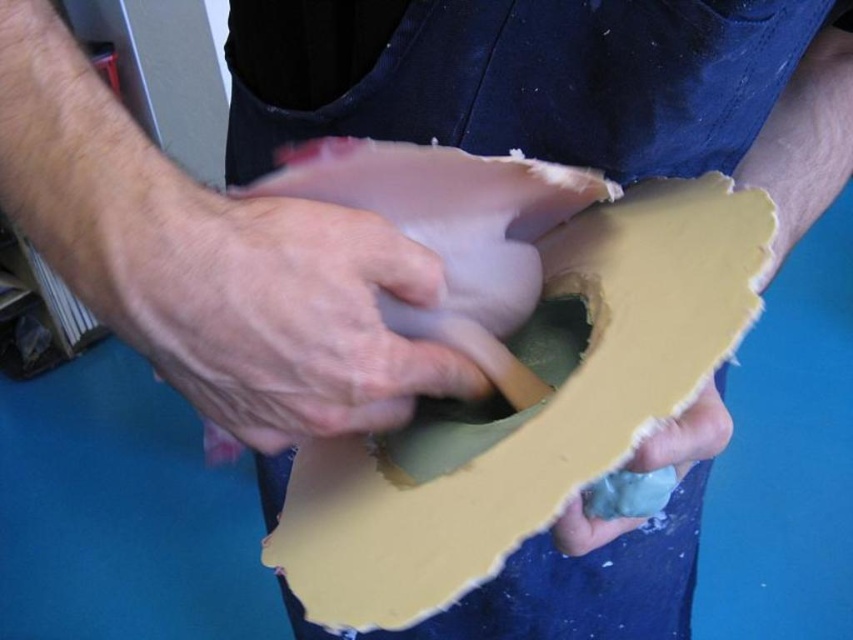
You are a craft instructor observing a student working on a project. The student has two materials at the center of their workspace. One is the matte yellow cardboard at center and the other is the dry matte skin at center. Which material is wider?

The matte yellow cardboard at center is wider than the dry matte skin at center.

You are an artist working on a craft project. You have two materials in front of you, the matte yellow cardboard at center and the matte yellow foam at lower center. Which material is positioned higher up in your workspace?

The matte yellow cardboard at center is located above the matte yellow foam at lower center, so it is positioned higher up in your workspace.

You are a craft instructor demonstrating a project and need to place a small sticker on the closest object to the viewer between the matte yellow cardboard at center and the matte yellow foam at lower center. Which object should you choose?

The matte yellow cardboard at center is in front of the matte yellow foam at lower center, so you should place the sticker on the matte yellow cardboard at center.